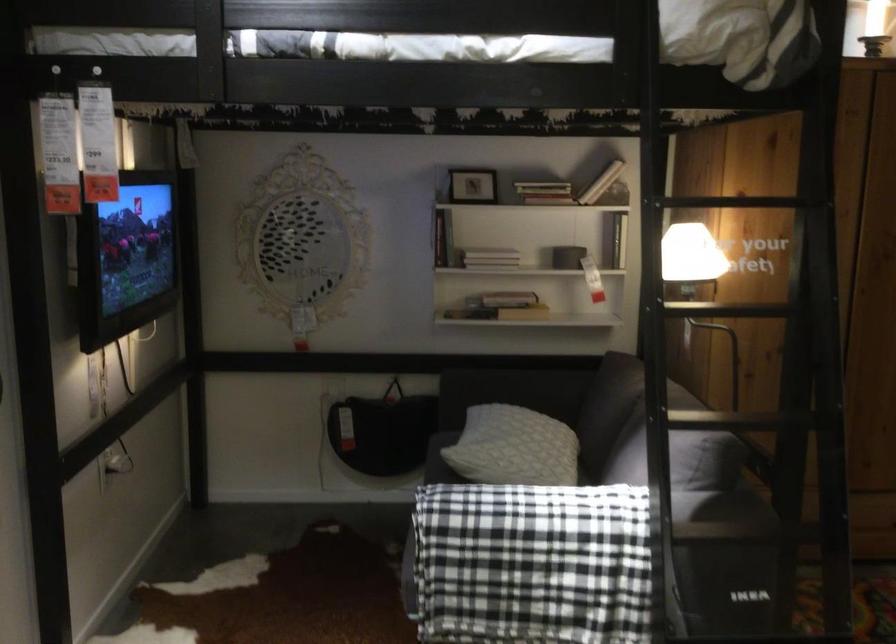
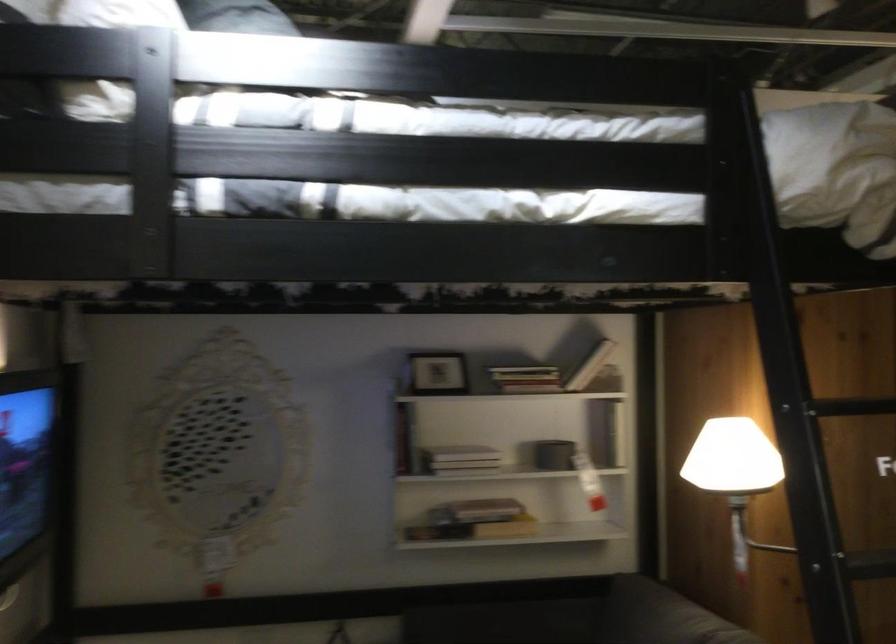
Find the pixel in the second image that matches pixel 504 292 in the first image.

(476, 511)